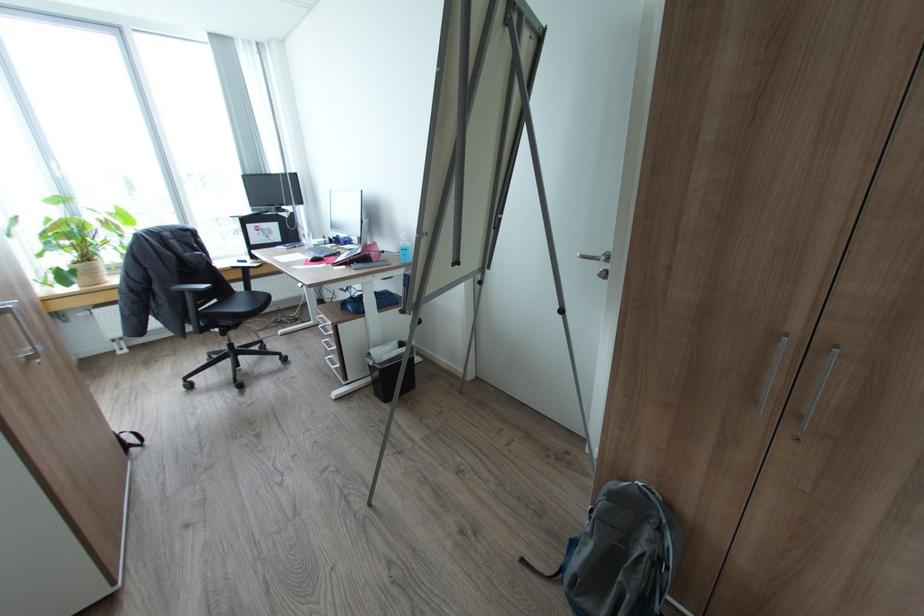
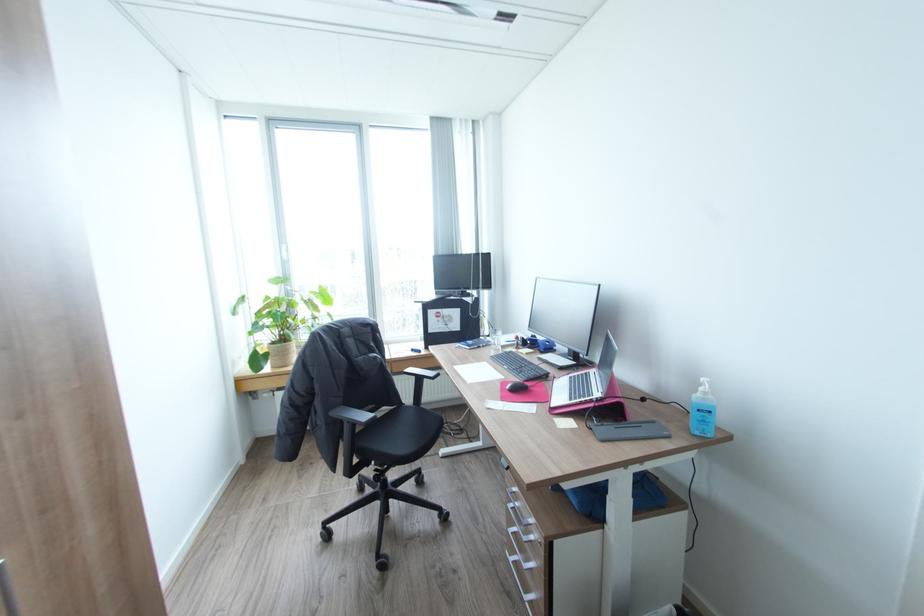
Locate, in the second image, the point that corresponds to point 246,270 in the first image.

(419, 378)